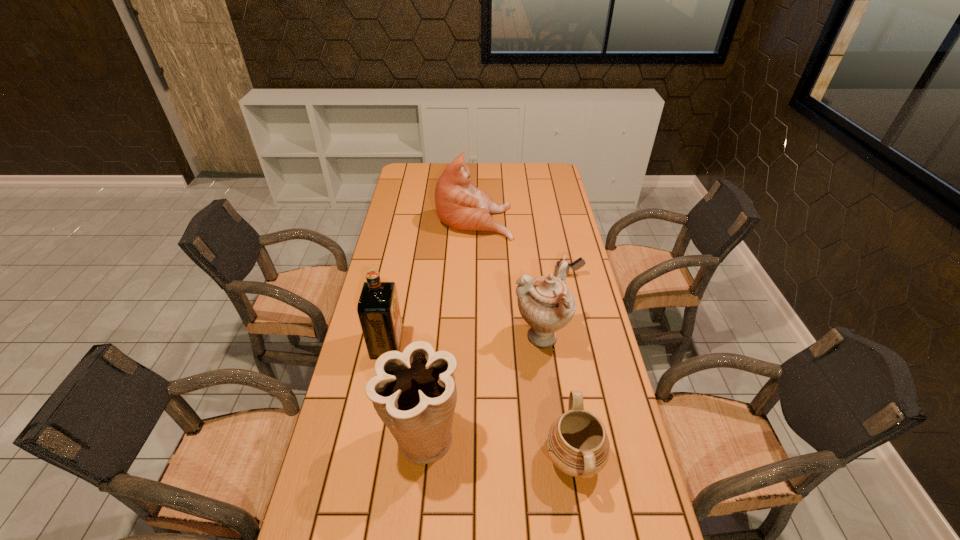
Locate an element on the screen. The image size is (960, 540). vacant space at the right edge is located at coordinates (563, 242).

Where is `vacant space at the far left corner`? This screenshot has height=540, width=960. vacant space at the far left corner is located at coordinates (429, 163).

Identify the location of vacant point located between the cat and the leftmost urn. The image size is (960, 540). (448, 329).

Where is `unoccupied area between the liquor and the fifth tallest object`? The height and width of the screenshot is (540, 960). unoccupied area between the liquor and the fifth tallest object is located at coordinates (480, 402).

Locate an element on the screen. free point between the shortest object and the liquor is located at coordinates (478, 310).

You are a GUI agent. You are given a task and a screenshot of the screen. Output one action in this format:
    pyautogui.click(x=<x>, y=<y>)
    Task: Click on the blank region between the liquor and the farthest urn
    The image size is (960, 540).
    Given the screenshot: What is the action you would take?
    pyautogui.click(x=464, y=342)

Identify the location of vacant region between the igniter and the farthest object. The width and height of the screenshot is (960, 540). (521, 247).

I want to click on free spot between the farthest urn and the liquor, so click(464, 342).

Find the location of `free area in between the leftmost urn and the farthest object`. free area in between the leftmost urn and the farthest object is located at coordinates (448, 329).

You are a GUI agent. You are given a task and a screenshot of the screen. Output one action in this format:
    pyautogui.click(x=<x>, y=<y>)
    Task: Click on the object that is the fifth closest to the farthest urn
    
    Given the screenshot: What is the action you would take?
    pyautogui.click(x=459, y=203)